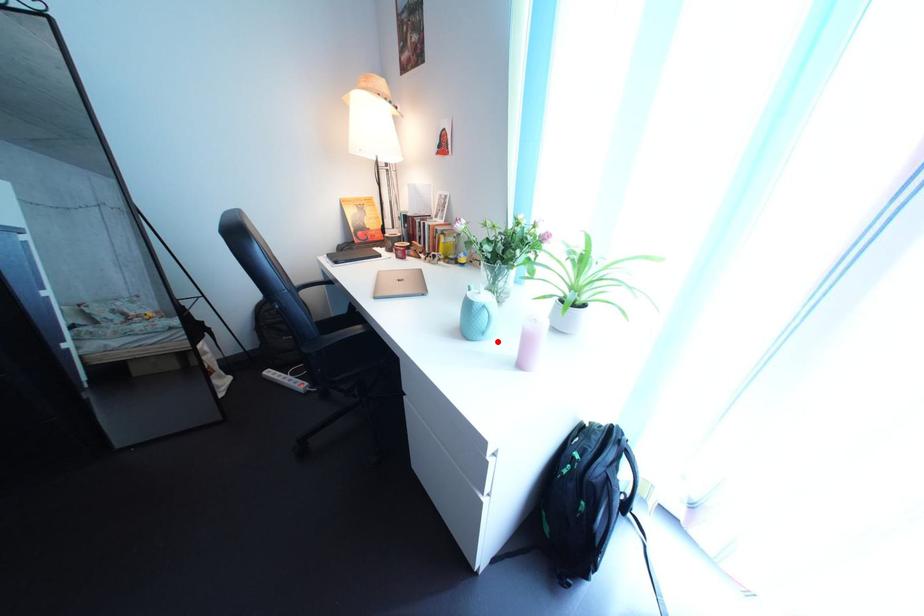
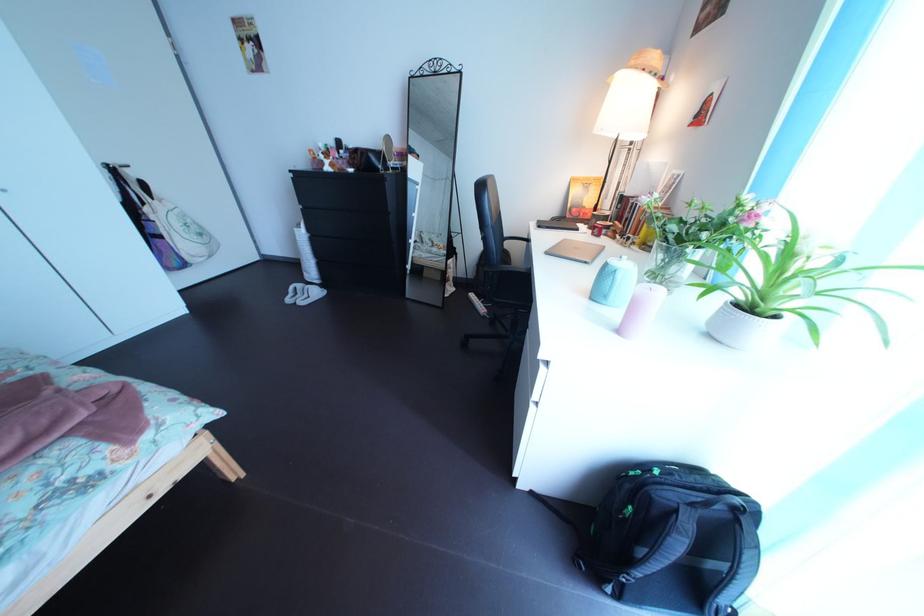
Question: I am providing you with two images of the same scene from different viewpoints. A red point is marked on the first image. Is the red point's position out of view in image 2?

Choices:
 (A) Yes
 (B) No

Answer: (B)